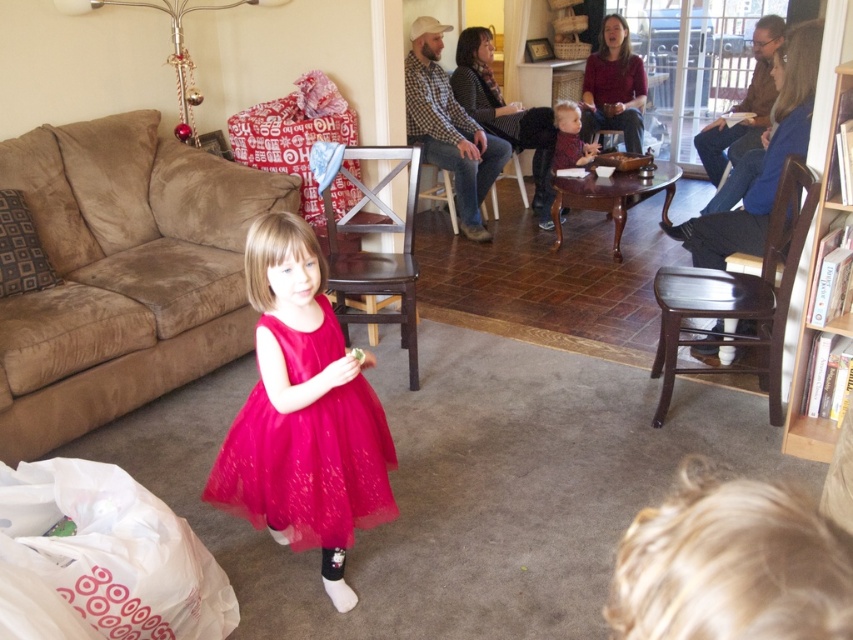
You are a photographer setting up for a photoshoot in this living room. You need to position two subjects wearing the fuchsia tulle dress at center and the matte red sweater at center. Given their clothing dimensions, which subject requires more space to accommodate their outfit?

The fuchsia tulle dress at center requires more space because its width is larger than the matte red sweater at center.

You are a guest in this living room and want to sit down. Which object, the suede couch at lower left or the matte red sweater at center, is more suitable for sitting?

The suede couch at lower left is much taller than the matte red sweater at center, so the suede couch at lower left is more suitable for sitting.

Looking at this image, you are standing in the living room and want to reach the point marked as point [171,145]. If your walking speed is 3 feet per second, how many seconds will it take you to reach that point?

The distance between you and point [171,145] is 12.15 feet. At a speed of 3 feet per second, it will take 12.15 divided by 3 equals 4.05 seconds to reach the point.